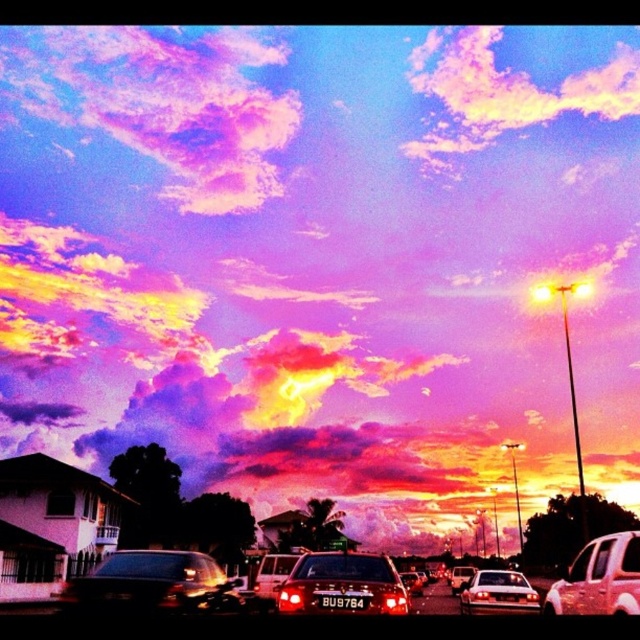
Can you confirm if pink fluffy cloud at upper center is wider than shiny black sedan at center?

Yes, pink fluffy cloud at upper center is wider than shiny black sedan at center.

In the scene shown: Is pink fluffy cloud at upper center thinner than shiny black sedan at center?

No, pink fluffy cloud at upper center is not thinner than shiny black sedan at center.

The height and width of the screenshot is (640, 640). Identify the location of pink fluffy cloud at upper center. (502, 93).

What are the coordinates of `pink fluffy cloud at upper center` in the screenshot? It's located at (502, 93).

Can you confirm if metallic silver car at right is shorter than black plastic license plate at center?

No.

Can you confirm if metallic silver car at right is bigger than black plastic license plate at center?

Indeed, metallic silver car at right has a larger size compared to black plastic license plate at center.

Does point (584, 572) come farther from viewer compared to point (326, 600)?

Yes, it is behind point (326, 600).

The image size is (640, 640). What are the coordinates of `metallic silver car at right` in the screenshot? It's located at (600, 579).

Is purple cotton candy cloud at upper left in front of black plastic license plate at center?

No.

Is point (250, 93) farther from camera compared to point (346, 595)?

That is True.

Describe the element at coordinates (163, 104) in the screenshot. I see `purple cotton candy cloud at upper left` at that location.

I want to click on purple cotton candy cloud at upper left, so click(x=163, y=104).